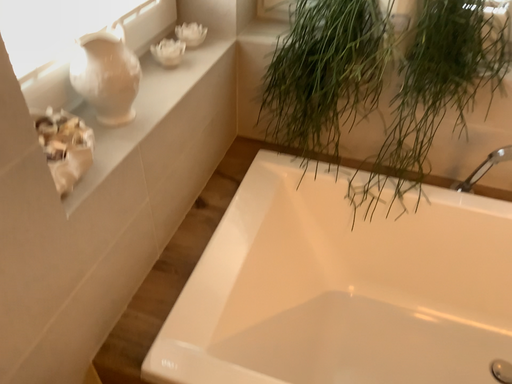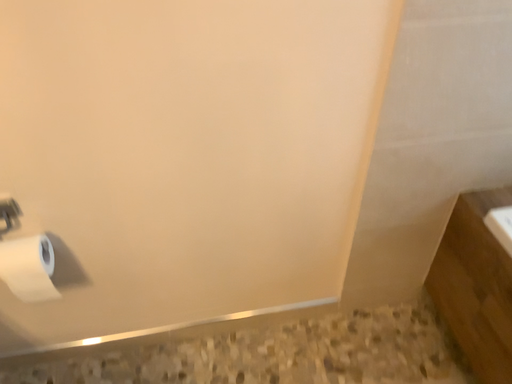
Question: How did the camera likely rotate when shooting the video?

Choices:
 (A) rotated upward
 (B) rotated downward

Answer: (A)